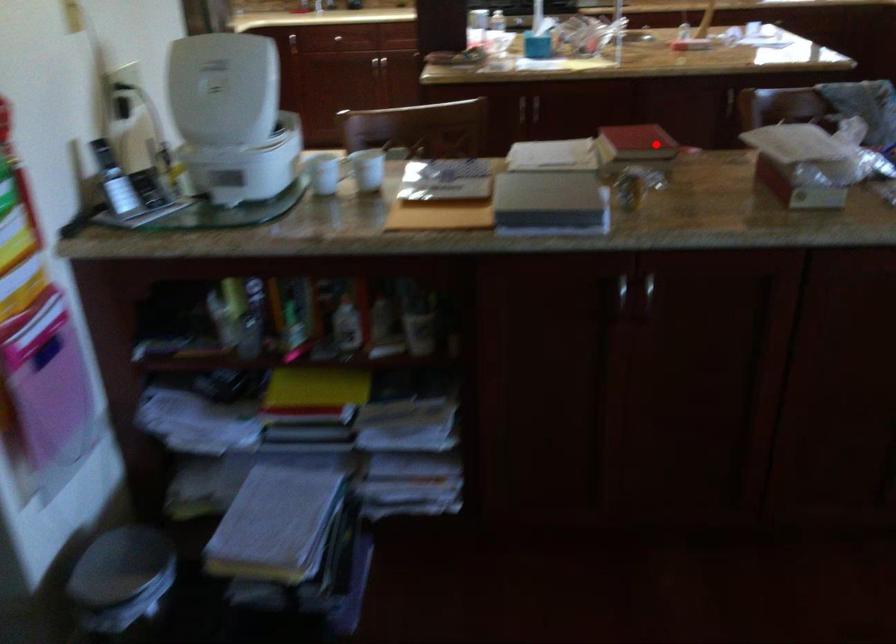
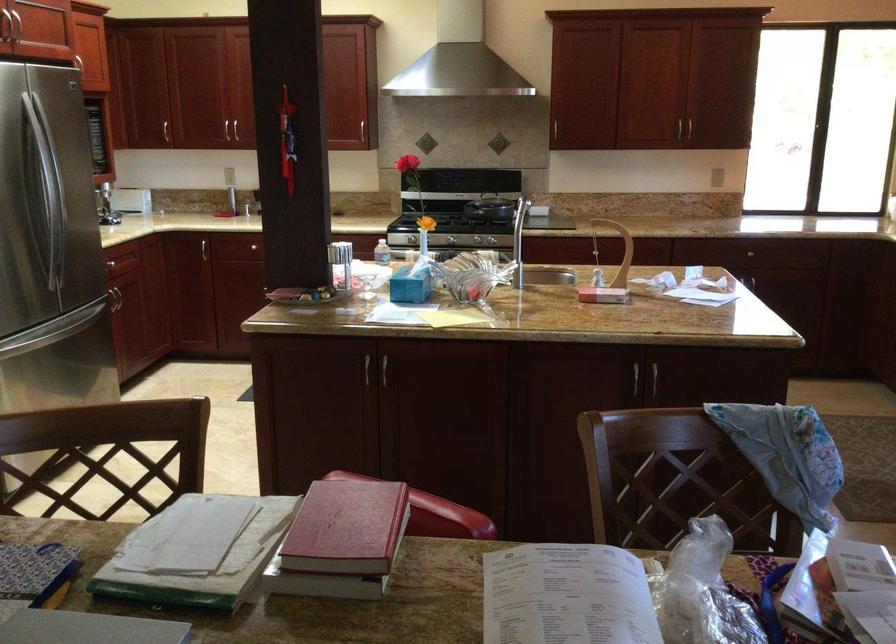
Where in the second image is the point corresponding to the highlighted location from the first image?

(346, 527)